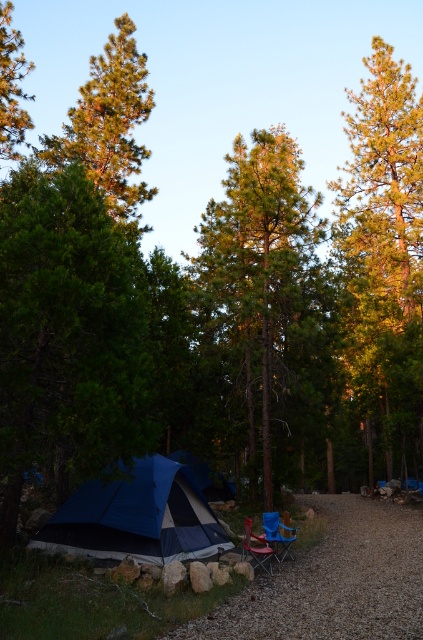
You are setting up a campsite and need to decide where to place your tent. You have a green textured pine tree at upper left and a blue fabric chair at lower right in your view. Which object should you avoid placing your tent near if you want to keep it away from larger obstacles?

You should avoid placing your tent near the green textured pine tree at upper left because it is larger in size than the blue fabric chair at lower right, making it a bigger obstacle.

You are setting up a campsite and need to place a new tent. The current tent is blue and gray and positioned in the foreground. Considering the location of the green pine tree at left, which is at coordinates point 0.134, 0.028, where should you place the new tent to ensure it is not too close to the tree?

The green pine tree at left is located at point [11,84]. To avoid placing the new tent too close to it, position the tent away from these coordinates, ensuring sufficient distance between the tree and the tent.

You are a hiker who just arrived at the campsite and wants to set up a small picnic table between the green pine tree at left and the blue fabric chair at lower right. Given that the picnic table requires 3 meters of space between the tree and the chair, is there enough room?

The green pine tree at left is 16.54 meters away from the blue fabric chair at lower right, so yes, there is more than enough space to set up the picnic table between them since the required distance is only 3 meters.